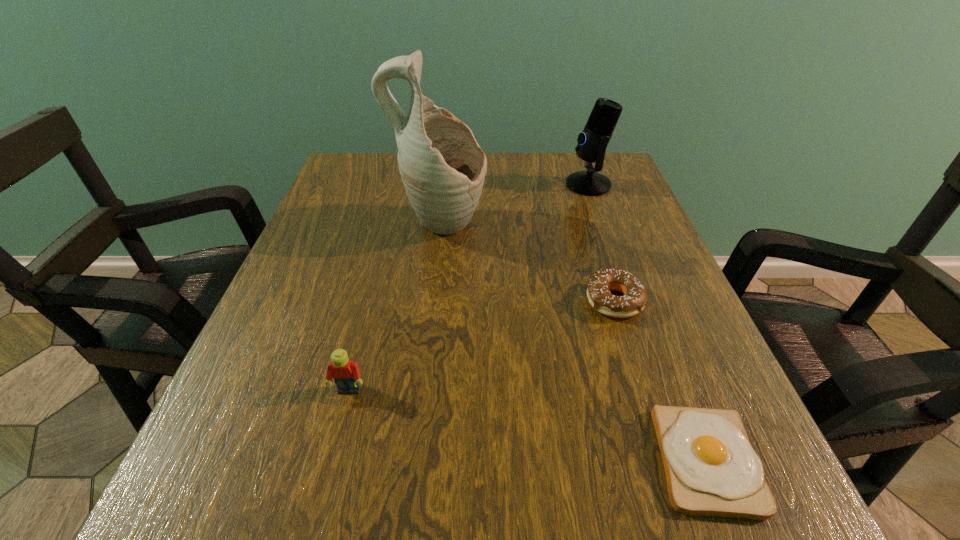
Where is `blank area in the image that satisfies the following two spatial constraints: 1. on the back side of the doughnut; 2. at the spout of the pitcher`? The image size is (960, 540). blank area in the image that satisfies the following two spatial constraints: 1. on the back side of the doughnut; 2. at the spout of the pitcher is located at coordinates (590, 227).

This screenshot has width=960, height=540. I want to click on free location that satisfies the following two spatial constraints: 1. at the spout of the tallest object; 2. on the left side of the nearest object, so click(x=414, y=461).